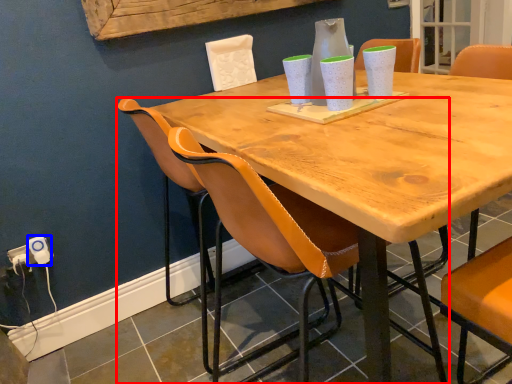
Question: Which object appears closest to the camera in this image, chair (highlighted by a red box) or electric outlet (highlighted by a blue box)?

Choices:
 (A) chair
 (B) electric outlet

Answer: (A)